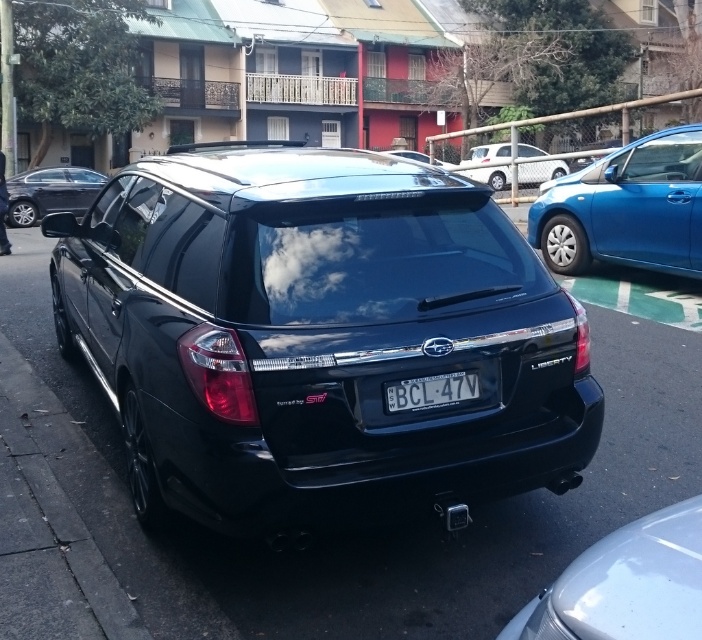
You are a delivery person trying to park a 6.5 feet long delivery van between the white matte sedan at center and the glossy black car at center. Can you fit your van between them without touching either vehicle?

The white matte sedan at center is 6.35 feet from the glossy black car at center. Since the delivery van is 6.5 feet long, it is slightly longer than the available space. Therefore, the van cannot fit between them without touching either vehicle.